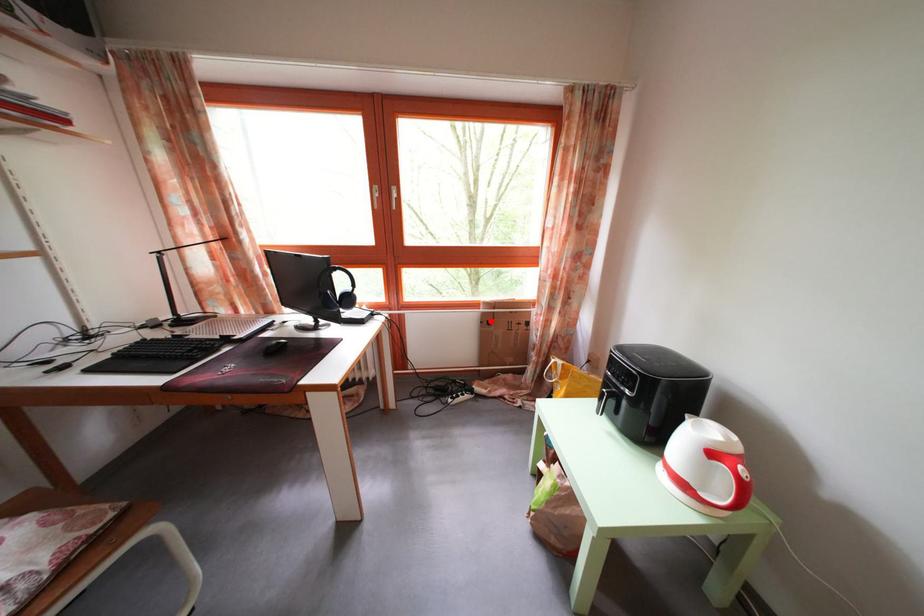
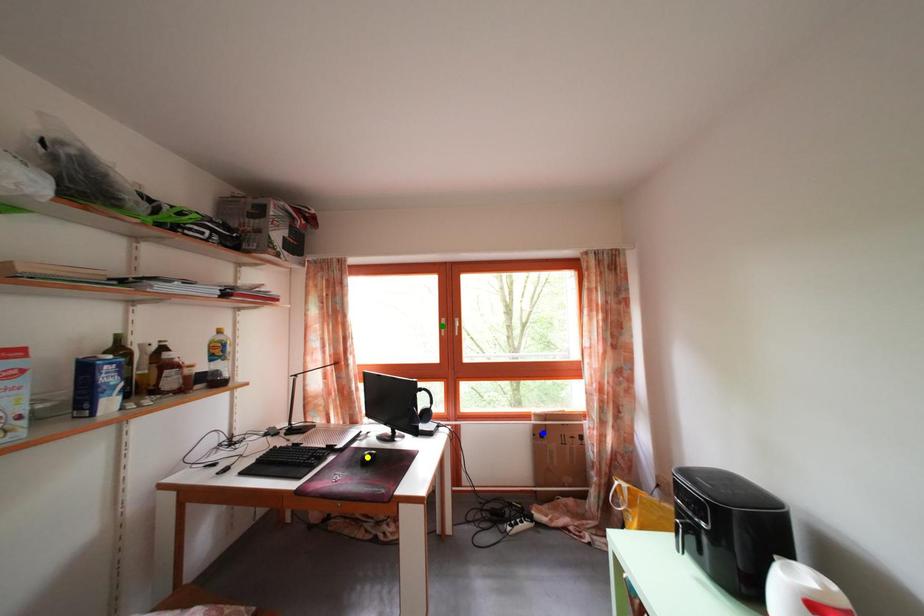
Question: I am providing you with two images of the same scene from different viewpoints. A red point is marked on the first image. You are given multiple points on the second image. Which spot in image 2 lines up with the point in image 1?

Choices:
 (A) yellow point
 (B) blue point
 (C) green point

Answer: (B)